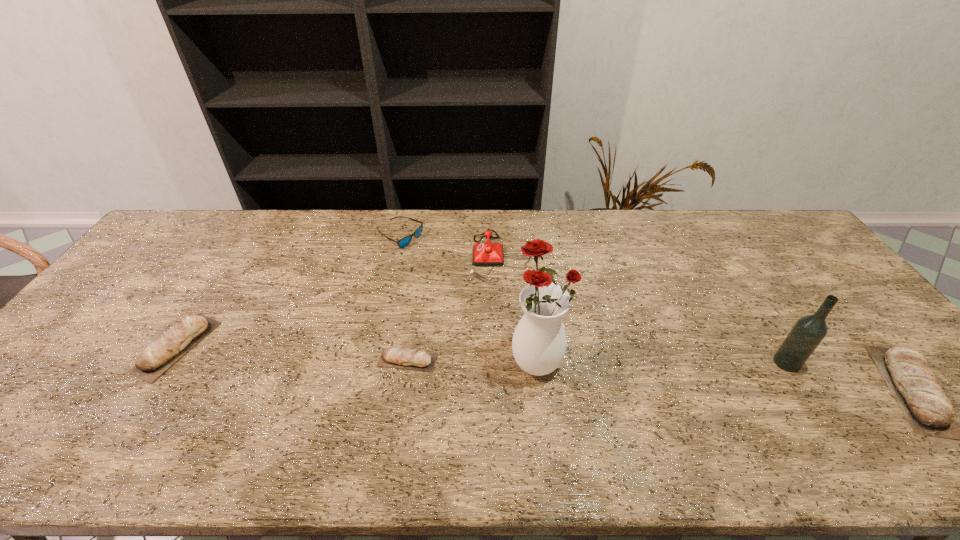
You are a GUI agent. You are given a task and a screenshot of the screen. Output one action in this format:
    pyautogui.click(x=<x>, y=<y>)
    Task: Click on the vacant point at the near edge
    The width and height of the screenshot is (960, 540).
    Given the screenshot: What is the action you would take?
    pyautogui.click(x=483, y=409)

Find the location of a particular element. This screenshot has height=540, width=960. vacant space at the left edge of the desktop is located at coordinates (137, 265).

This screenshot has width=960, height=540. In the image, there is a desktop. In order to click on vacant region at the far right corner in this screenshot , I will do `click(772, 236)`.

Where is `free space between the sunglasses and the vodka`? The width and height of the screenshot is (960, 540). free space between the sunglasses and the vodka is located at coordinates (593, 300).

Identify the location of free space between the vase and the second pita bread from left to right. tap(472, 360).

The height and width of the screenshot is (540, 960). Identify the location of free space between the third tallest object and the sunglasses. (450, 247).

Locate an element on the screen. This screenshot has height=540, width=960. vacant space in between the telephone and the vase is located at coordinates (518, 308).

In order to click on free space that is in between the second tallest pita bread and the vodka in this screenshot , I will do `click(482, 355)`.

Locate an element on the screen. The width and height of the screenshot is (960, 540). empty space between the sunglasses and the second pita bread from right to left is located at coordinates (404, 299).

The height and width of the screenshot is (540, 960). Find the location of `empty space between the sunglasses and the vase`. empty space between the sunglasses and the vase is located at coordinates pos(468,298).